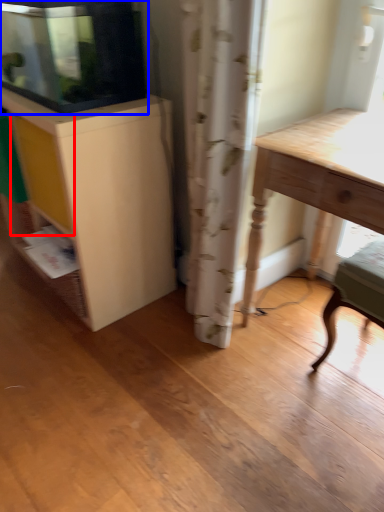
Question: Which object appears closest to the camera in this image, drawer (highlighted by a red box) or cabinetry (highlighted by a blue box)?

Choices:
 (A) drawer
 (B) cabinetry

Answer: (B)